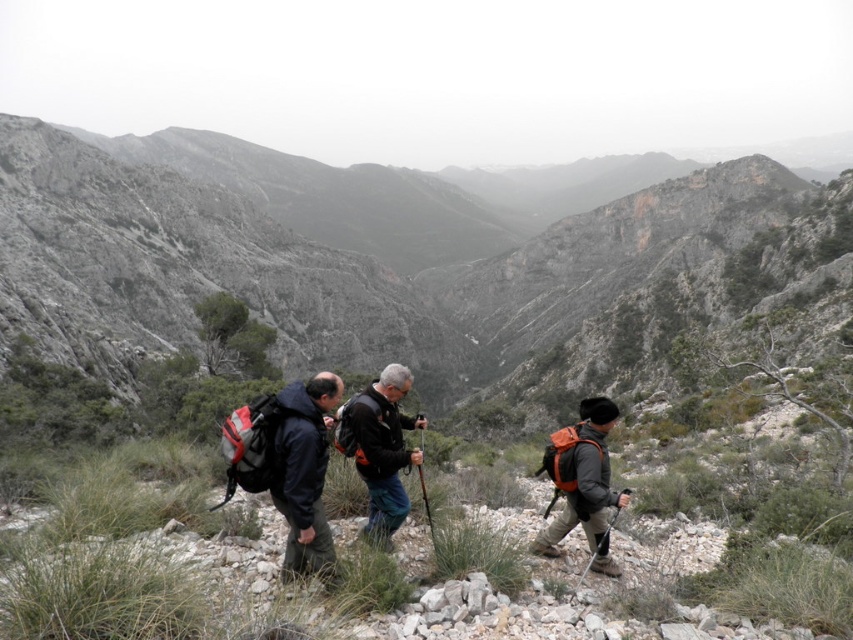
Question: Which of the following is the farthest from the observer?

Choices:
 (A) (416, 420)
 (B) (61, 180)

Answer: (B)

Question: Is rugged stone mountain at center above orange fabric backpack at right?

Choices:
 (A) yes
 (B) no

Answer: (A)

Question: Which point is farther from the camera taking this photo?

Choices:
 (A) (558, 536)
 (B) (61, 212)
 (C) (376, 515)

Answer: (B)

Question: Considering the relative positions of rugged stone mountain at center and dark blue jacket at center in the image provided, where is rugged stone mountain at center located with respect to dark blue jacket at center?

Choices:
 (A) right
 (B) left

Answer: (B)

Question: Is rugged stone mountain at center bigger than dark blue jacket at center?

Choices:
 (A) no
 (B) yes

Answer: (B)

Question: Which object is positioned farthest from the orange fabric backpack at right?

Choices:
 (A) rugged stone mountain at center
 (B) dark blue jacket at center

Answer: (A)